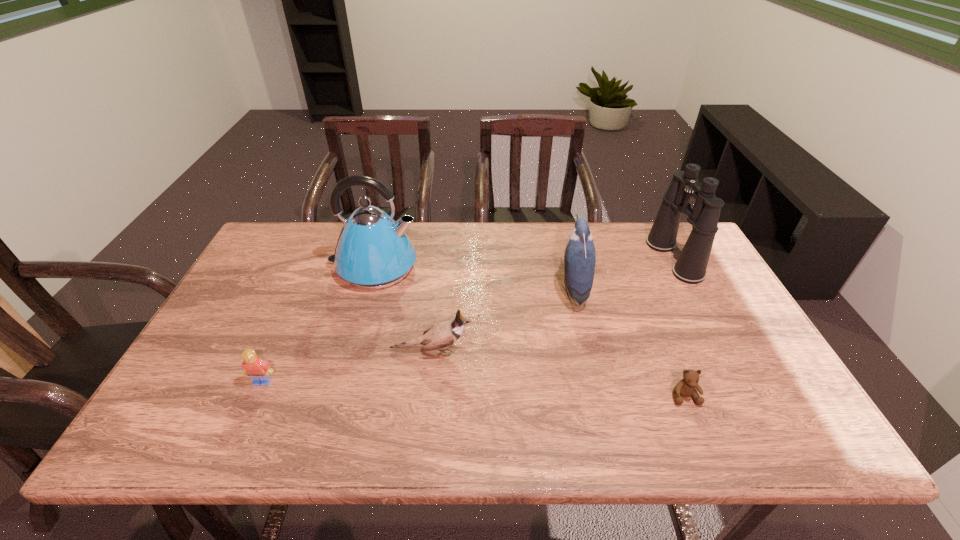
I want to click on blank space located at the spout of the kettle, so (435, 267).

Image resolution: width=960 pixels, height=540 pixels. In order to click on free location located on the left of the rightmost object in this screenshot , I will do `click(558, 259)`.

This screenshot has height=540, width=960. What are the coordinates of `free location located at the tip of the third tallest object's beak` in the screenshot? It's located at (500, 289).

Locate an element on the screen. This screenshot has width=960, height=540. vacant space located at the tip of the third tallest object's beak is located at coordinates (473, 289).

The height and width of the screenshot is (540, 960). Identify the location of vacant space positioned 0.070m at the tip of the third tallest object's beak. (535, 289).

Find the location of `free region located at the face of the shorter bird`. free region located at the face of the shorter bird is located at coordinates (516, 350).

Where is `vacant region located 0.140m on the front-facing side of the Lego`? vacant region located 0.140m on the front-facing side of the Lego is located at coordinates (236, 443).

At what (x,y) coordinates should I click in order to perform the action: click on vacant region located 0.090m on the front-facing side of the fifth object from left to right. Please return your answer as a coordinate pair (x, y). The image size is (960, 540). Looking at the image, I should click on (704, 445).

The height and width of the screenshot is (540, 960). I want to click on kettle situated at the far edge, so click(x=373, y=251).

Find the location of a particular element. This screenshot has height=540, width=960. binoculars located in the far edge section of the desktop is located at coordinates (691, 266).